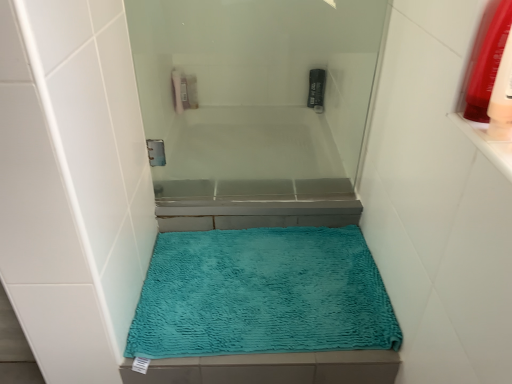
Question: Choose the correct answer: Is transparent glass screen door at upper center inside translucent plastic mouthwash at upper right, marked as the 2th mouthwash in a top-to-bottom arrangement, or outside it?

Choices:
 (A) outside
 (B) inside

Answer: (A)

Question: From a real-world perspective, is transparent glass screen door at upper center positioned above or below translucent plastic mouthwash at upper right, which ranks as the second mouthwash in back-to-front order?

Choices:
 (A) below
 (B) above

Answer: (A)

Question: Estimate the real-world distances between objects in this image. Which object is farther from the black plastic mouthwash at upper center, which is the 1th mouthwash from back to front?

Choices:
 (A) transparent glass screen door at upper center
 (B) teal plush bath mat at center
 (C) translucent plastic mouthwash at upper right, marked as the first mouthwash in a right-to-left arrangement

Answer: (B)

Question: Considering the real-world distances, which object is closest to the black plastic mouthwash at upper center, placed as the 1th mouthwash when sorted from top to bottom?

Choices:
 (A) teal plush bath mat at center
 (B) transparent glass screen door at upper center
 (C) translucent plastic mouthwash at upper right, marked as the first mouthwash in a right-to-left arrangement

Answer: (B)